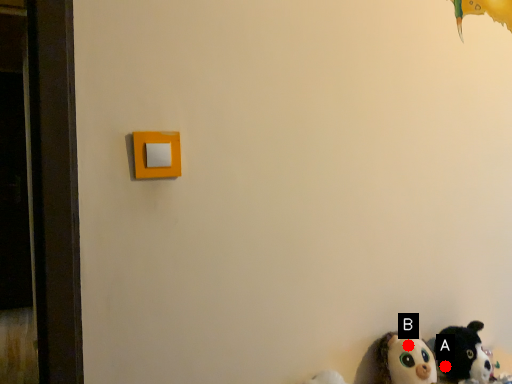
Question: Two points are circled on the image, labeled by A and B beside each circle. Which of the following is the farthest from the observer?

Choices:
 (A) A is further
 (B) B is further

Answer: (A)